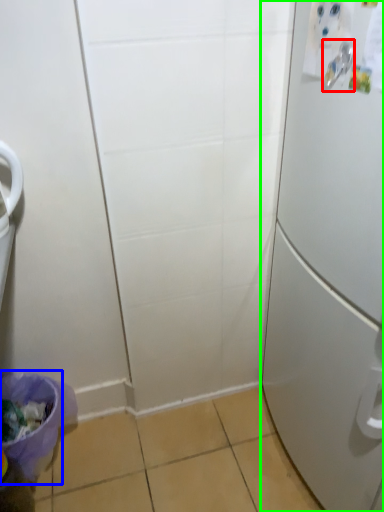
Question: Which object is the farthest from door handle (highlighted by a red box)? Choose among these: potty (highlighted by a blue box) or refrigerator (highlighted by a green box).

Choices:
 (A) potty
 (B) refrigerator

Answer: (A)